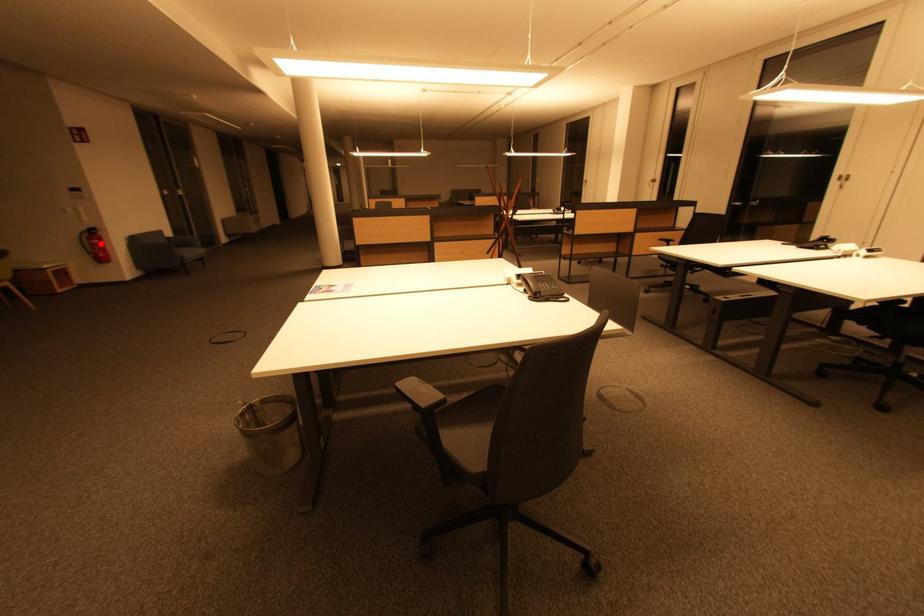
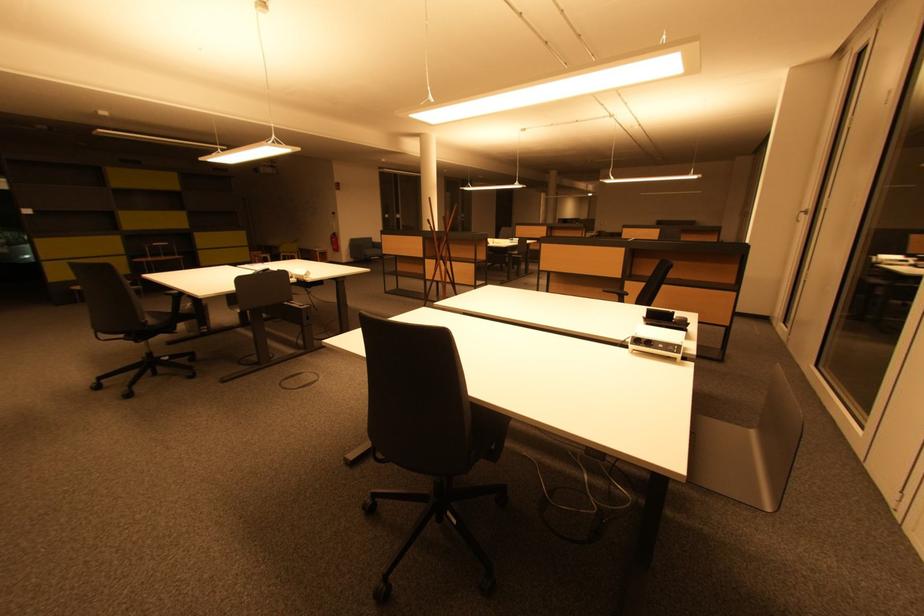
Locate, in the second image, the point that corresponds to the highlighted location in the first image.

(338, 241)